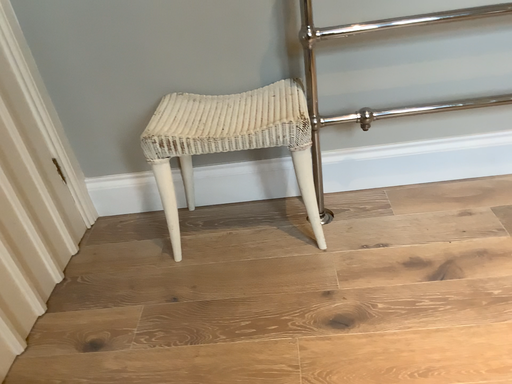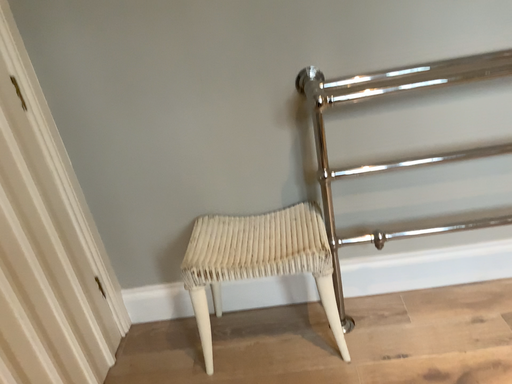
Question: Which way did the camera rotate in the video?

Choices:
 (A) rotated downward
 (B) rotated upward

Answer: (B)